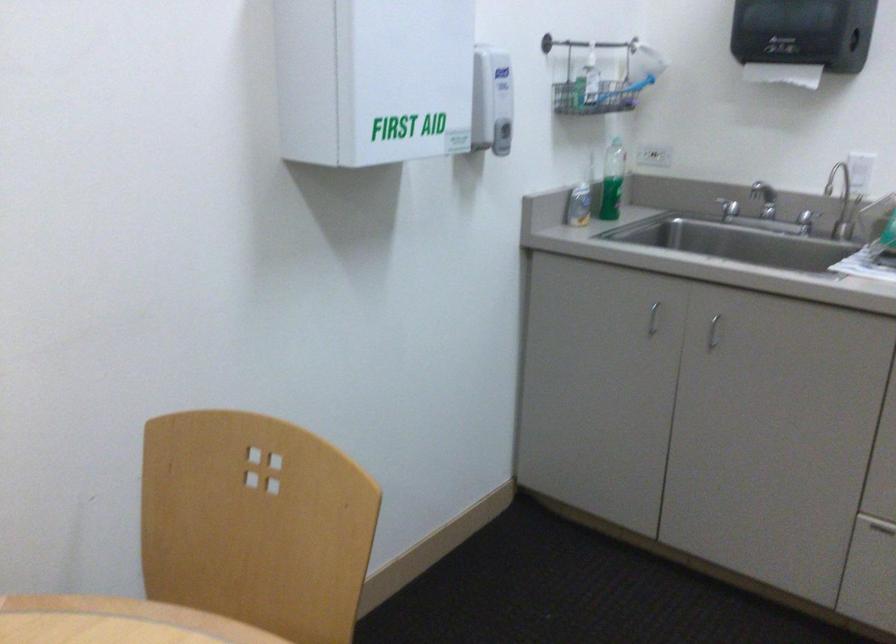
Locate an element on the screen. This screenshot has height=644, width=896. green soap bottle is located at coordinates (613, 181).